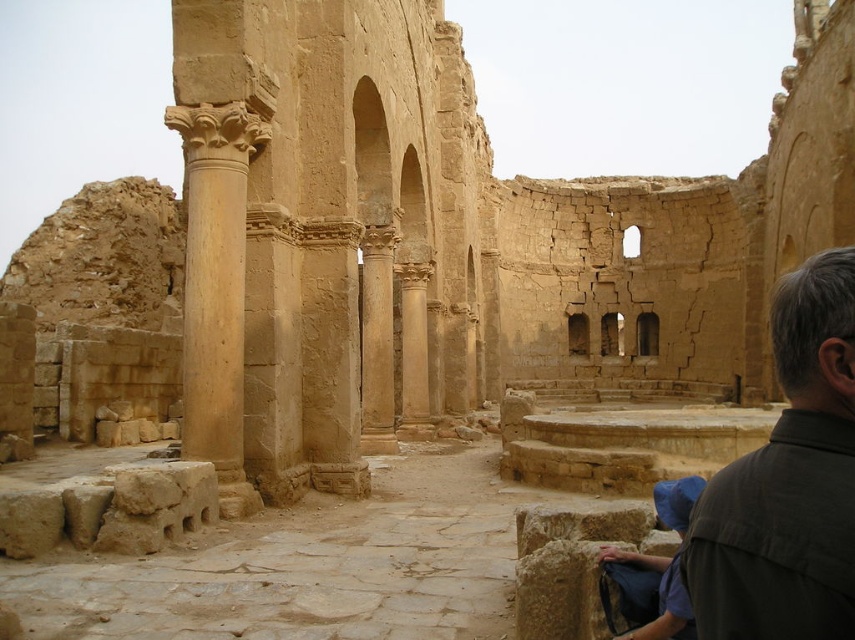
Question: Which point is closer to the camera?

Choices:
 (A) (806, 285)
 (B) (187, 138)

Answer: (A)

Question: Does dark brown shirt at lower right have a greater width compared to smooth sandstone column at center-left?

Choices:
 (A) yes
 (B) no

Answer: (A)

Question: Is dark brown shirt at lower right to the left of smooth sandstone column at center-left from the viewer's perspective?

Choices:
 (A) yes
 (B) no

Answer: (B)

Question: Which point is closer to the camera taking this photo?

Choices:
 (A) (213, 252)
 (B) (753, 524)

Answer: (B)

Question: Which object is farther from the camera taking this photo?

Choices:
 (A) dark brown shirt at lower right
 (B) smooth sandstone column at center-left

Answer: (B)

Question: Does dark brown shirt at lower right appear on the right side of smooth sandstone column at center-left?

Choices:
 (A) yes
 (B) no

Answer: (A)